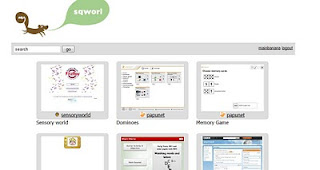
This screenshot has width=320, height=170. I want to click on square artwork, so click(x=77, y=146).